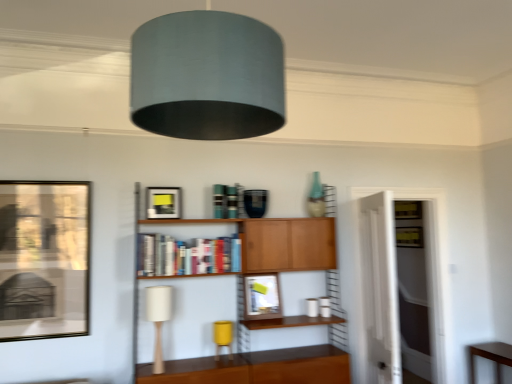
Question: Considering the relative sizes of white fabric table lamp at lower left, arranged as the second table lamp when viewed from the back, and matte black picture frame at left, acting as the first picture frame starting from the left, in the image provided, is white fabric table lamp at lower left, arranged as the second table lamp when viewed from the back, shorter than matte black picture frame at left, acting as the first picture frame starting from the left,?

Choices:
 (A) no
 (B) yes

Answer: (B)

Question: Does white fabric table lamp at lower left, arranged as the second table lamp when viewed from the back, touch matte black picture frame at left, which ranks as the first picture frame in front-to-back order?

Choices:
 (A) no
 (B) yes

Answer: (A)

Question: From the image's perspective, would you say white fabric table lamp at lower left, the second table lamp from the right, is shown under matte black picture frame at left, the 3th picture frame from the back?

Choices:
 (A) yes
 (B) no

Answer: (A)

Question: Is white fabric table lamp at lower left, the second table lamp from the right, positioned behind matte black picture frame at left, acting as the first picture frame starting from the left?

Choices:
 (A) yes
 (B) no

Answer: (B)

Question: Considering the relative positions of white fabric table lamp at lower left, the first table lamp from the left, and matte black picture frame at left, which ranks as the first picture frame in front-to-back order, in the image provided, is white fabric table lamp at lower left, the first table lamp from the left, to the left of matte black picture frame at left, which ranks as the first picture frame in front-to-back order, from the viewer's perspective?

Choices:
 (A) yes
 (B) no

Answer: (B)

Question: In the image, is transparent glass door at right positioned in front of or behind brown wooden table at lower right?

Choices:
 (A) front
 (B) behind

Answer: (B)

Question: From the image's perspective, is transparent glass door at right positioned above or below brown wooden table at lower right?

Choices:
 (A) below
 (B) above

Answer: (B)

Question: From a real-world perspective, relative to brown wooden table at lower right, is transparent glass door at right vertically above or below?

Choices:
 (A) above
 (B) below

Answer: (A)

Question: Does point (426, 198) appear closer or farther from the camera than point (510, 365)?

Choices:
 (A) closer
 (B) farther

Answer: (B)

Question: Is point (215, 327) positioned closer to the camera than point (22, 283)?

Choices:
 (A) farther
 (B) closer

Answer: (A)

Question: From a real-world perspective, is yellow matte table lamp at lower center, the 1th table lamp when ordered from back to front, positioned above or below matte black picture frame at left, arranged as the third picture frame when viewed from the right?

Choices:
 (A) above
 (B) below

Answer: (B)

Question: From the image's perspective, is yellow matte table lamp at lower center, arranged as the first table lamp when viewed from the right, above or below matte black picture frame at left, acting as the first picture frame starting from the left?

Choices:
 (A) above
 (B) below

Answer: (B)

Question: Based on their sizes in the image, would you say yellow matte table lamp at lower center, the 1th table lamp when ordered from back to front, is bigger or smaller than matte black picture frame at left, the 3th picture frame from the back?

Choices:
 (A) big
 (B) small

Answer: (B)

Question: Looking at the image, does matte black picture frame at upper center, which is counted as the second picture frame, starting from the back, seem bigger or smaller compared to brown wooden table at lower right?

Choices:
 (A) small
 (B) big

Answer: (A)

Question: In the image, is matte black picture frame at upper center, the 2th picture frame when ordered from left to right, on the left side or the right side of brown wooden table at lower right?

Choices:
 (A) right
 (B) left

Answer: (B)